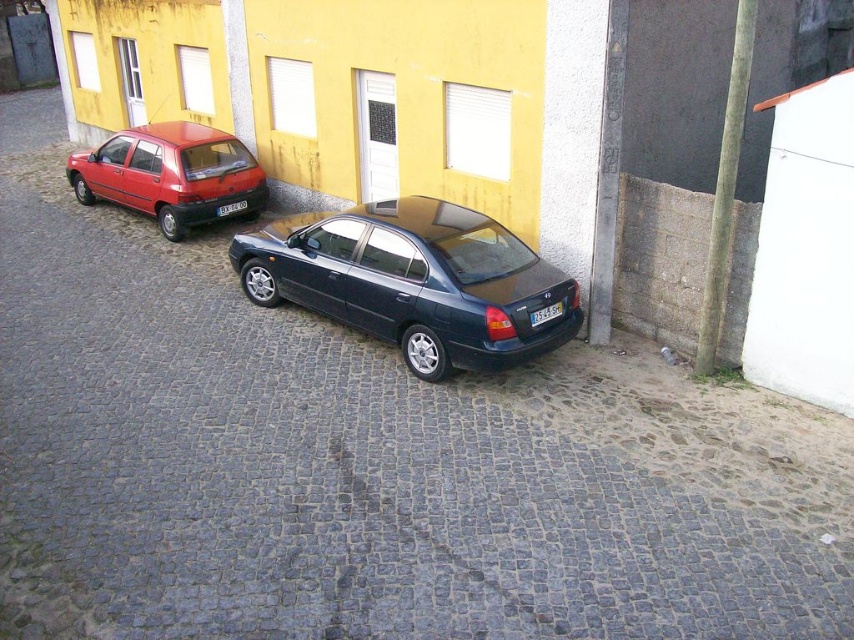
Does white plastic license plate at center have a smaller size compared to black plastic license plate at center?

Yes, white plastic license plate at center is smaller than black plastic license plate at center.

Does white plastic license plate at center have a lesser height compared to black plastic license plate at center?

Yes, white plastic license plate at center is shorter than black plastic license plate at center.

Image resolution: width=854 pixels, height=640 pixels. What do you see at coordinates (545, 314) in the screenshot?
I see `white plastic license plate at center` at bounding box center [545, 314].

The height and width of the screenshot is (640, 854). Find the location of `white plastic license plate at center`. white plastic license plate at center is located at coordinates (545, 314).

Between glossy dark blue sedan at center and matte red sedan at left, which one is positioned lower?

glossy dark blue sedan at center is below.

Does glossy dark blue sedan at center have a smaller size compared to matte red sedan at left?

Actually, glossy dark blue sedan at center might be larger than matte red sedan at left.

Between point (422, 372) and point (230, 164), which one is positioned in front?

Point (422, 372) is in front.

The height and width of the screenshot is (640, 854). What are the coordinates of `glossy dark blue sedan at center` in the screenshot? It's located at (414, 280).

Consider the image. Between matte red sedan at left and black plastic license plate at center, which one appears on the right side from the viewer's perspective?

Positioned to the right is black plastic license plate at center.

You are a GUI agent. You are given a task and a screenshot of the screen. Output one action in this format:
    pyautogui.click(x=<x>, y=<y>)
    Task: Click on the matte red sedan at left
    The width and height of the screenshot is (854, 640).
    Given the screenshot: What is the action you would take?
    pyautogui.click(x=170, y=173)

What are the coordinates of `matte red sedan at left` in the screenshot? It's located at (170, 173).